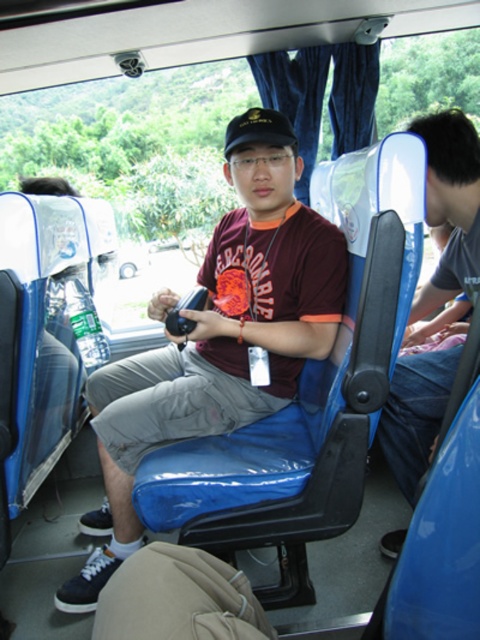
You are a photographer on the bus and want to take a photo of the matte blue shirt at center and the black fabric baseball hat at center. Which object is located to the left of the other?

The black fabric baseball hat at center is located to the left of the matte blue shirt at center because the matte blue shirt at center is positioned on the right side of the black fabric baseball hat at center.

You are standing in the bus and want to take a photo of the central figure. The camera you have can focus on objects up to 2 meters away. Is the point at coordinate (x=442, y=394) within the camera focus range?

The point at coordinate (x=442, y=394) is 1.79 meters away from the viewer, which is within the camera focus range of up to 2 meters. Yes, the camera can focus on it.